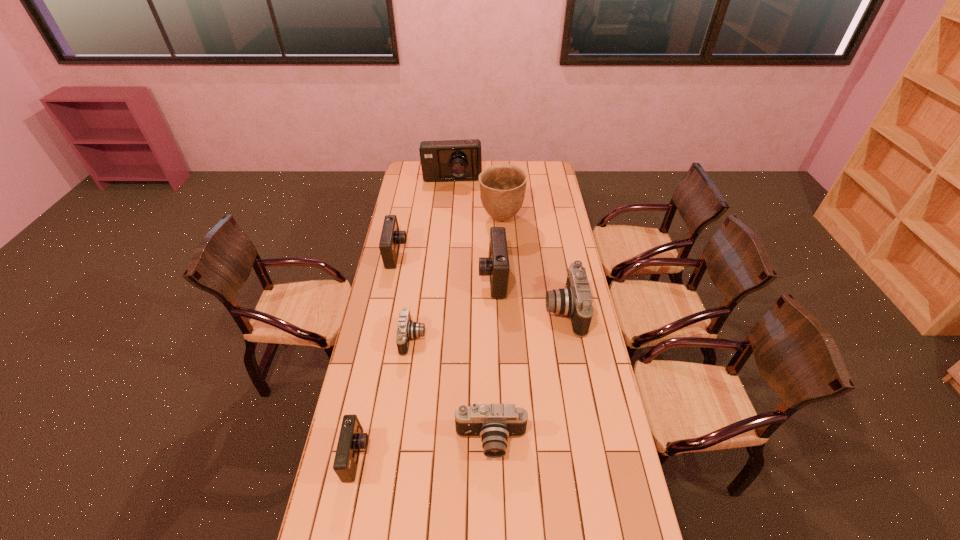
Where is `the leftmost black camera`? The width and height of the screenshot is (960, 540). the leftmost black camera is located at coordinates (407, 329).

Locate an element on the screen. The image size is (960, 540). free space located 0.150m on the back of the seventh nearest object is located at coordinates (500, 191).

You are a GUI agent. You are given a task and a screenshot of the screen. Output one action in this format:
    pyautogui.click(x=<x>, y=<y>)
    Task: Click on the vacant space situated on the front-facing side of the biggest blue camera
    This screenshot has height=540, width=960.
    Given the screenshot: What is the action you would take?
    450,208

The width and height of the screenshot is (960, 540). What are the coordinates of `vacant space located on the front-facing side of the third smallest blue camera` in the screenshot? It's located at (432, 278).

Find the location of a particular element. This screenshot has height=540, width=960. free spot located on the front-facing side of the third smallest blue camera is located at coordinates (396, 278).

Locate an element on the screen. The width and height of the screenshot is (960, 540). vacant space located 0.270m on the front-facing side of the third smallest blue camera is located at coordinates (420, 278).

Find the location of a particular element. The image size is (960, 540). vacant space positioned 0.350m on the front-facing side of the rightmost black camera is located at coordinates (464, 311).

Where is `vacant space located 0.260m on the front-facing side of the rightmost black camera`? Image resolution: width=960 pixels, height=540 pixels. vacant space located 0.260m on the front-facing side of the rightmost black camera is located at coordinates 485,311.

This screenshot has width=960, height=540. What are the coordinates of `free space located 0.110m on the front-facing side of the rightmost black camera` in the screenshot? It's located at (519, 311).

At what (x,y) coordinates should I click in order to perform the action: click on vacant point located on the front-facing side of the third biggest blue camera. Please return your answer as a coordinate pair (x, y). Looking at the image, I should click on (447, 254).